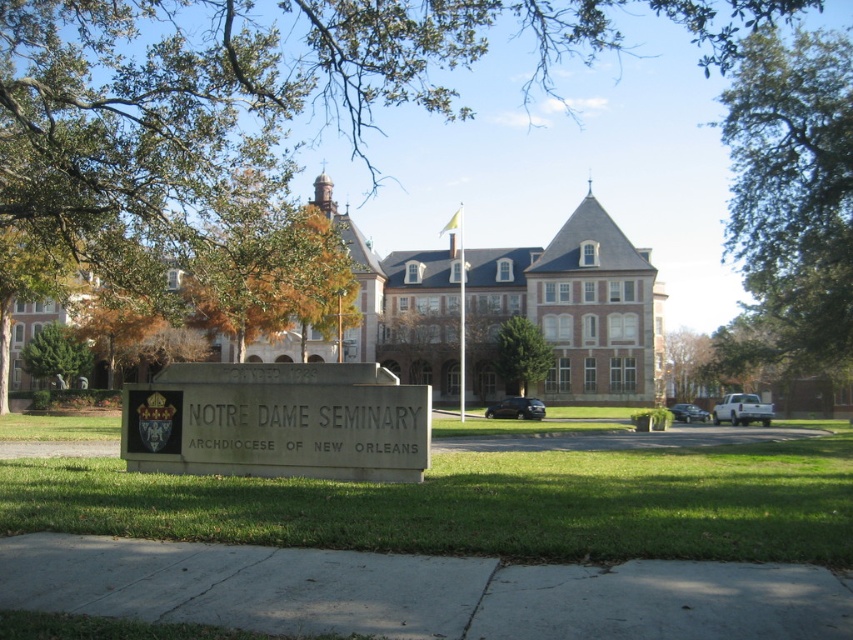
Question: Is green leafy tree at center positioned at the back of green leafy tree at upper left?

Choices:
 (A) yes
 (B) no

Answer: (A)

Question: Can you confirm if green leafy tree at center is thinner than green leafy tree at upper left?

Choices:
 (A) yes
 (B) no

Answer: (A)

Question: Estimate the real-world distances between objects in this image. Which object is farther from the green leafy tree at upper left?

Choices:
 (A) gray stone sign at center
 (B) green leafy tree at upper right

Answer: (A)

Question: Which point is closer to the camera?

Choices:
 (A) green leafy tree at center
 (B) green leafy tree at upper right
 (C) green leafy tree at upper left
 (D) gray stone sign at center

Answer: (D)

Question: Does gray stone sign at center appear over green leafy tree at upper left?

Choices:
 (A) no
 (B) yes

Answer: (A)

Question: Among these points, which one is farthest from the camera?

Choices:
 (A) (364, 112)
 (B) (785, 221)

Answer: (A)